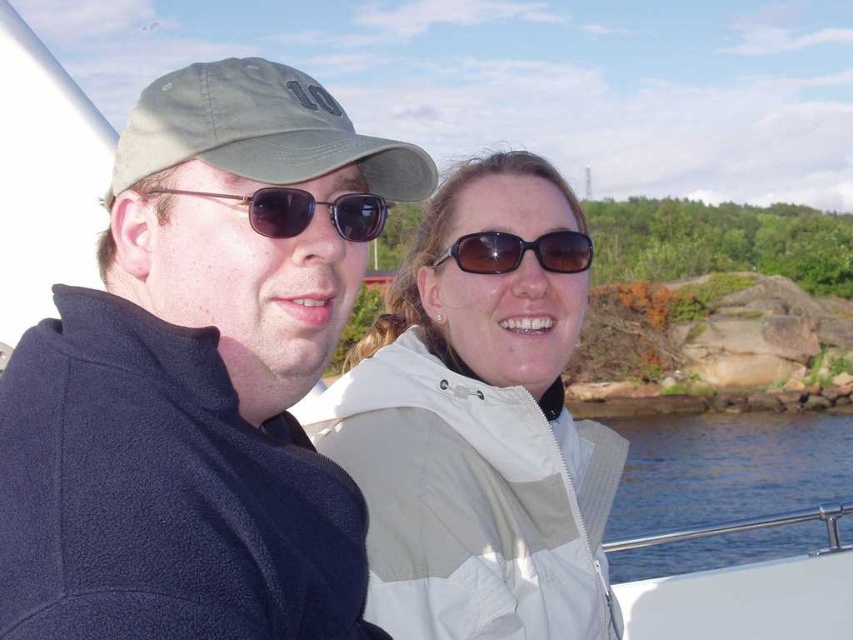
You are a photographer trying to capture a photo of both people on the boat. You notice two points marked in the scene. The first point is at coordinates point (317, 83) and the second is at point (474, 241). Which of these points is located behind the other?

Point (317, 83) is behind point (474, 241) according to the description.

From the picture: You are standing on the boat where the two people are sitting. You want to reach the point closer to you between the two points labeled as point [154,189] and point [563,237]. Which point should you aim for?

You should aim for point [154,189] because it is closer to the viewer than point [563,237] according to the description.

You are trying to identify the two people on the boat. The shiny dark brown sunglasses at center and the brown reflective sunglasses at center are both in the middle of the image. Which pair of sunglasses is positioned more to the left?

The shiny dark brown sunglasses at center is to the left of brown reflective sunglasses at center, so the shiny dark brown sunglasses at center is positioned more to the left.